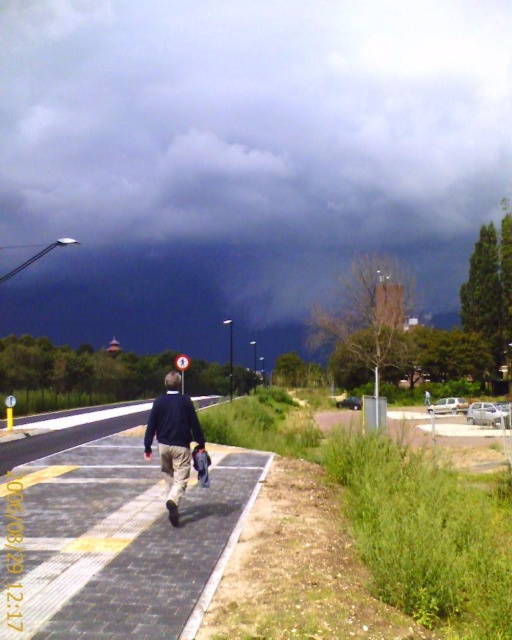
Question: Based on their relative distances, which object is farther from the dark blue sweater at center?

Choices:
 (A) dark gray cloud at upper center
 (B) black asphalt pavement at center

Answer: (A)

Question: From the image, what is the correct spatial relationship of dark gray cloud at upper center in relation to dark blue sweater at center?

Choices:
 (A) right
 (B) left

Answer: (A)

Question: Among these points, which one is farthest from the camera?

Choices:
 (A) (193, 438)
 (B) (205, 493)
 (C) (109, 81)

Answer: (C)

Question: Can you confirm if dark gray cloud at upper center is thinner than black asphalt pavement at center?

Choices:
 (A) no
 (B) yes

Answer: (A)

Question: Based on their relative distances, which object is farther from the black asphalt pavement at center?

Choices:
 (A) dark blue sweater at center
 (B) dark gray cloud at upper center

Answer: (B)

Question: Can you confirm if black asphalt pavement at center is smaller than dark blue sweater at center?

Choices:
 (A) yes
 (B) no

Answer: (B)